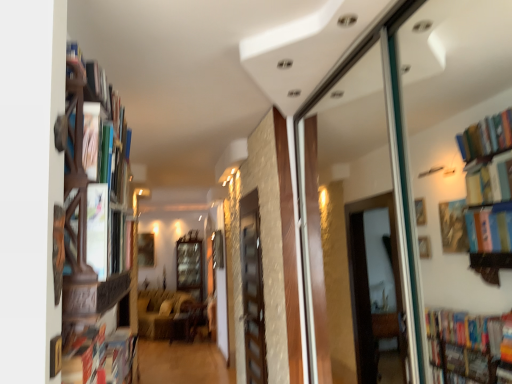
Question: Is velvet beige sofa at center surrounded by wooden cabinet at center?

Choices:
 (A) yes
 (B) no

Answer: (B)

Question: Is wooden cabinet at center to the left of velvet beige sofa at center from the viewer's perspective?

Choices:
 (A) no
 (B) yes

Answer: (A)

Question: Does wooden cabinet at center have a smaller size compared to velvet beige sofa at center?

Choices:
 (A) no
 (B) yes

Answer: (B)

Question: From a real-world perspective, is wooden cabinet at center located higher than velvet beige sofa at center?

Choices:
 (A) yes
 (B) no

Answer: (A)

Question: Is wooden cabinet at center turned away from velvet beige sofa at center?

Choices:
 (A) no
 (B) yes

Answer: (A)

Question: From the image's perspective, is wooden cabinet at center positioned above or below velvet beige sofa at center?

Choices:
 (A) below
 (B) above

Answer: (B)

Question: Based on their sizes in the image, would you say wooden cabinet at center is bigger or smaller than velvet beige sofa at center?

Choices:
 (A) big
 (B) small

Answer: (B)

Question: Considering the positions of point (183, 279) and point (183, 337), is point (183, 279) closer or farther from the camera than point (183, 337)?

Choices:
 (A) closer
 (B) farther

Answer: (B)

Question: Is wooden cabinet at center situated inside velvet beige sofa at center or outside?

Choices:
 (A) outside
 (B) inside

Answer: (A)

Question: Considering the positions of wooden cabinet at center and wooden screen door at center in the image, is wooden cabinet at center wider or thinner than wooden screen door at center?

Choices:
 (A) wide
 (B) thin

Answer: (A)

Question: Considering the positions of wooden cabinet at center and wooden screen door at center in the image, is wooden cabinet at center bigger or smaller than wooden screen door at center?

Choices:
 (A) small
 (B) big

Answer: (B)

Question: From their relative heights in the image, would you say wooden cabinet at center is taller or shorter than wooden screen door at center?

Choices:
 (A) short
 (B) tall

Answer: (B)

Question: Is wooden cabinet at center to the left or to the right of wooden screen door at center in the image?

Choices:
 (A) left
 (B) right

Answer: (A)

Question: Relative to wooden screen door at center, is wooden bookshelf at left in front or behind?

Choices:
 (A) behind
 (B) front

Answer: (B)

Question: Is wooden bookshelf at left bigger or smaller than wooden screen door at center?

Choices:
 (A) small
 (B) big

Answer: (B)